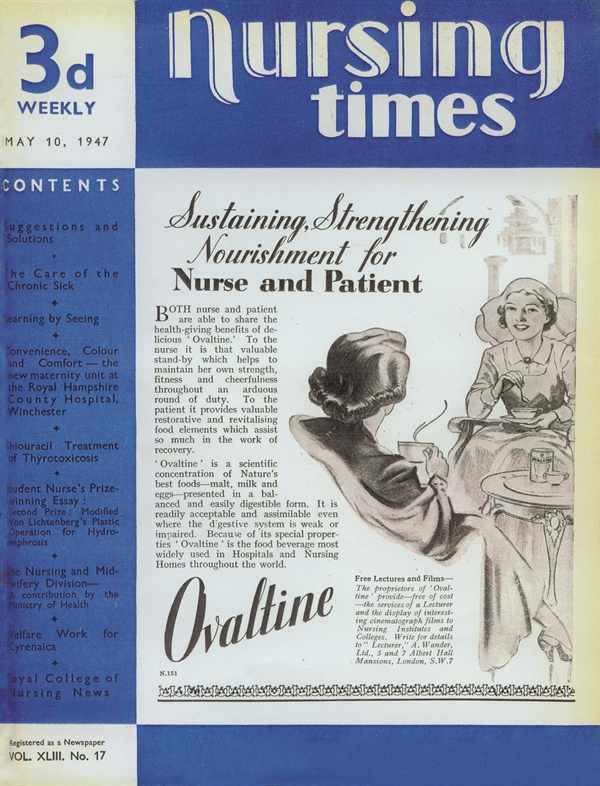
The image size is (600, 786). What are the coordinates of `circular table` in the screenshot? It's located at (522, 493).